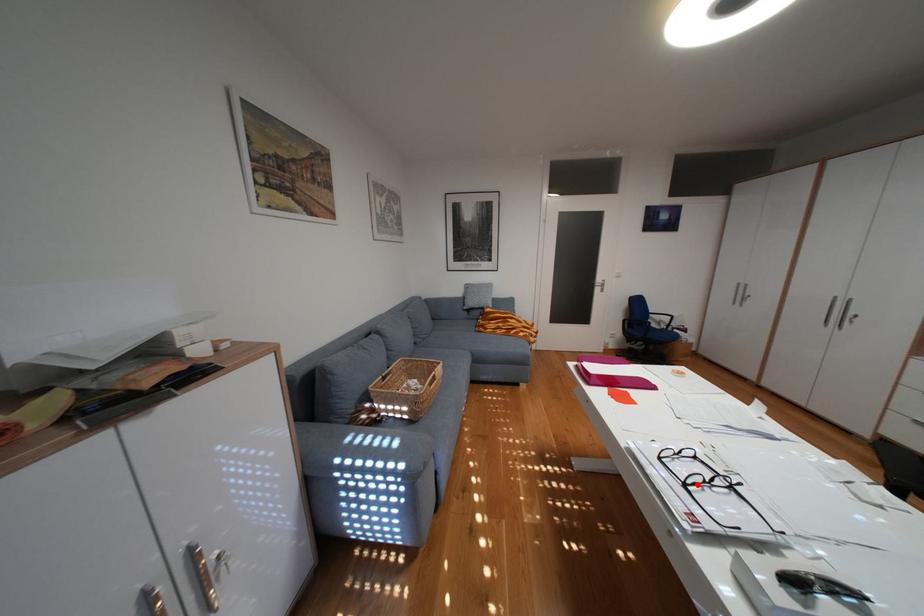
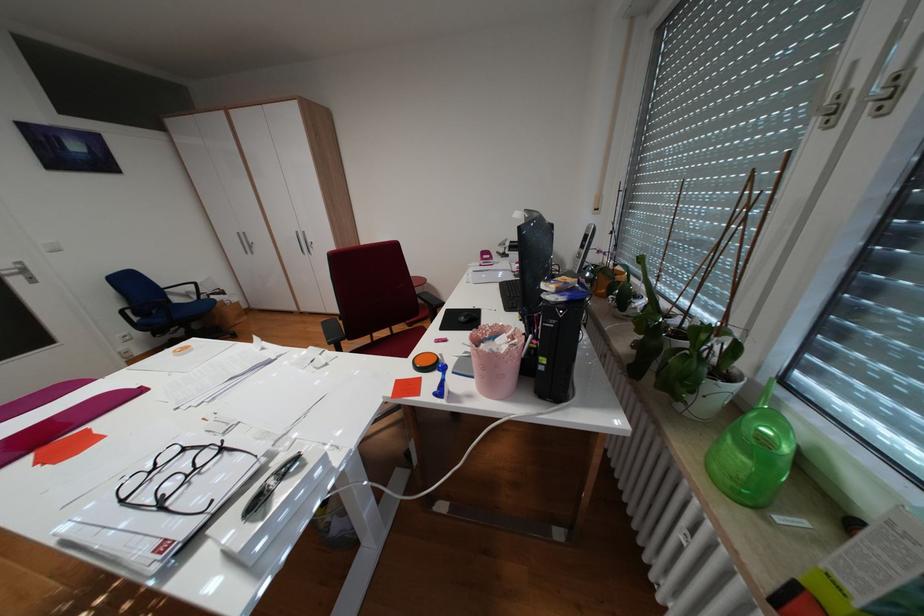
Where in the second image is the point corresponding to the highlighted location from the first image?

(173, 505)